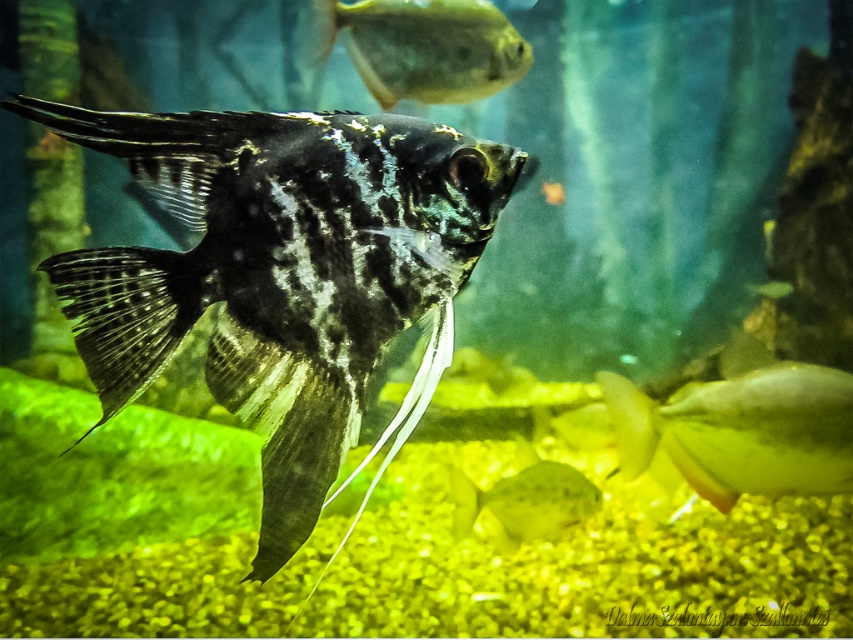
Question: Does shiny black fish at center appear under shiny yellow fish at lower right?

Choices:
 (A) no
 (B) yes

Answer: (A)

Question: Does shiny yellow fish at lower right have a larger size compared to translucent yellowish fish at lower center?

Choices:
 (A) yes
 (B) no

Answer: (B)

Question: Which point appears closest to the camera in this image?

Choices:
 (A) (373, 60)
 (B) (309, 506)

Answer: (B)

Question: Is shiny black fish at center above shiny yellow fish at upper center?

Choices:
 (A) no
 (B) yes

Answer: (A)

Question: Based on their relative distances, which object is nearer to the shiny black fish at center?

Choices:
 (A) shiny yellow fish at lower right
 (B) shiny yellow fish at upper center

Answer: (A)

Question: Which point is closer to the camera taking this photo?

Choices:
 (A) (459, 36)
 (B) (258, 392)
 (C) (837, 477)
 (D) (547, 461)

Answer: (B)